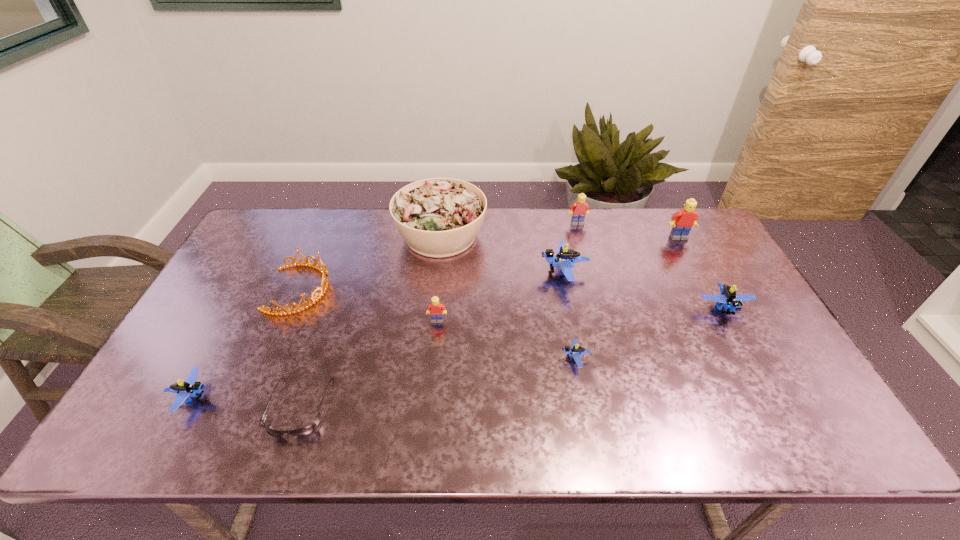
The width and height of the screenshot is (960, 540). I want to click on free space in the image that satisfies the following two spatial constraints: 1. on the front-facing side of the rightmost blue Lego; 2. on the front-facing side of the eighth farthest object, so click(752, 359).